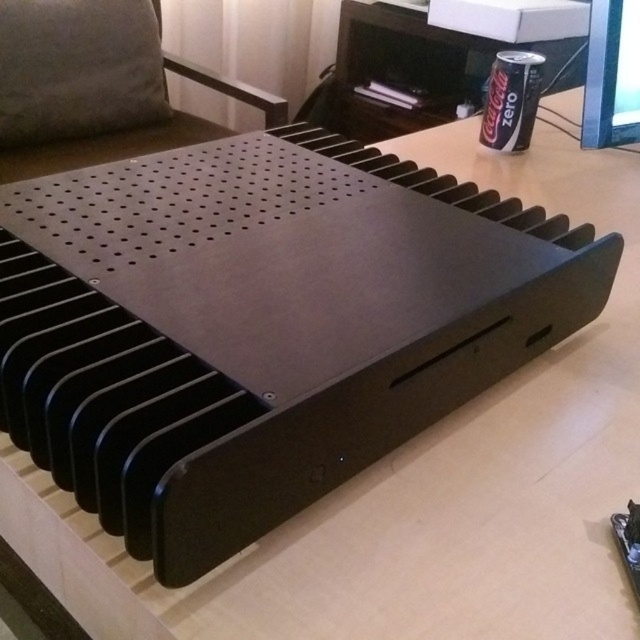
Question: In this image, where is metallic silver monitor at upper right located relative to black matte can at upper right?

Choices:
 (A) left
 (B) right

Answer: (B)

Question: Which of the following is the farthest from the observer?

Choices:
 (A) (614, 33)
 (B) (99, 148)
 (C) (509, 138)

Answer: (B)

Question: Among these points, which one is nearest to the camera?

Choices:
 (A) (605, 29)
 (B) (513, 90)

Answer: (A)

Question: Does black matte metal object at center come in front of black matte can at upper right?

Choices:
 (A) no
 (B) yes

Answer: (A)

Question: In this image, where is metallic silver monitor at upper right located relative to black matte can at upper right?

Choices:
 (A) right
 (B) left

Answer: (A)

Question: Which object is the farthest from the black matte metal object at center?

Choices:
 (A) black matte can at upper right
 (B) metallic silver monitor at upper right

Answer: (B)